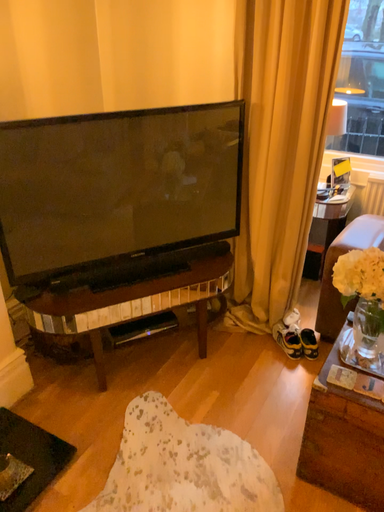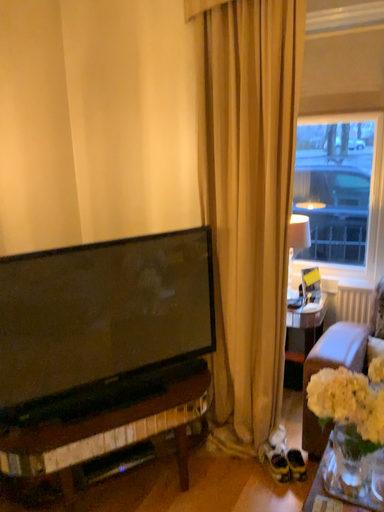
Question: Which way did the camera rotate in the video?

Choices:
 (A) rotated upward
 (B) rotated downward

Answer: (A)